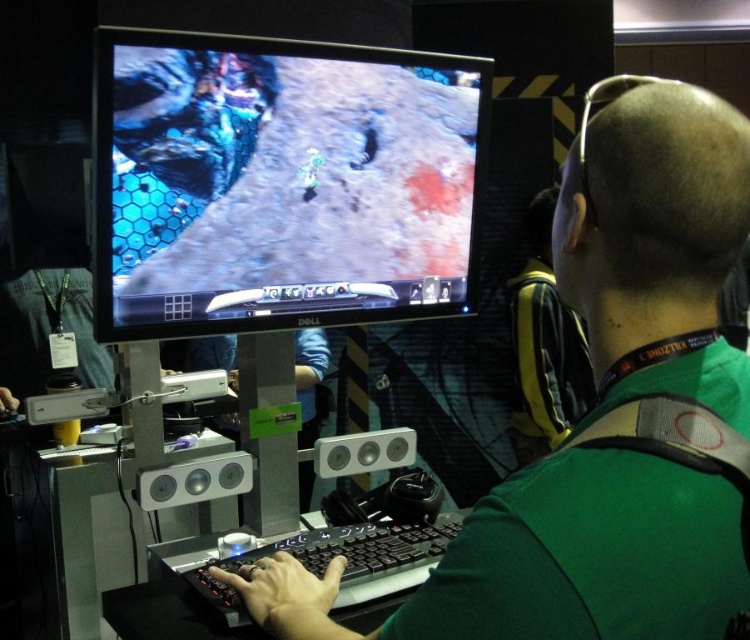
You are a game developer analyzing the layout of the gaming setup. The point at coordinates (280, 182) is marked on the screen. Which object does this point correspond to?

The point at coordinates (280, 182) corresponds to the black glossy monitor at upper center.

You are a photographer at a gaming event. You need to capture a photo of the green matte shirt at center and the yellow fabric backpack at upper right. Which object should you zoom in on to ensure both are clearly visible in the frame?

The green matte shirt at center is bigger than the yellow fabric backpack at upper right, so you should zoom in on the green matte shirt at center to ensure both are clearly visible in the frame.